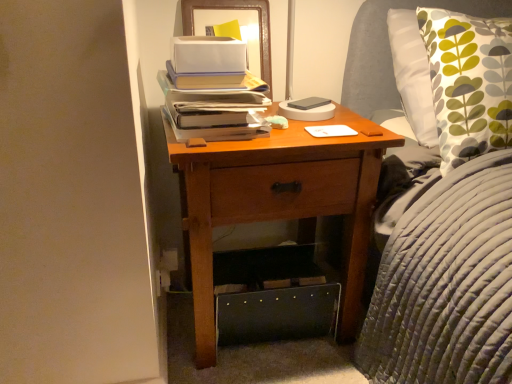
Question: From a real-world perspective, is matte paper stack of books at center on wooden nightstand at center?

Choices:
 (A) yes
 (B) no

Answer: (A)

Question: From a real-world perspective, does matte paper stack of books at center sit lower than wooden nightstand at center?

Choices:
 (A) no
 (B) yes

Answer: (A)

Question: Considering the relative sizes of matte paper stack of books at center and wooden nightstand at center in the image provided, is matte paper stack of books at center bigger than wooden nightstand at center?

Choices:
 (A) no
 (B) yes

Answer: (A)

Question: Is matte paper stack of books at center located outside wooden nightstand at center?

Choices:
 (A) yes
 (B) no

Answer: (A)

Question: Is matte paper stack of books at center in contact with wooden nightstand at center?

Choices:
 (A) yes
 (B) no

Answer: (B)

Question: From the image's perspective, is matte paper stack of books at center under wooden nightstand at center?

Choices:
 (A) yes
 (B) no

Answer: (B)

Question: Can you confirm if white matte notepad at center is positioned to the right of matte paper stack of books at center?

Choices:
 (A) no
 (B) yes

Answer: (B)

Question: From the image's perspective, would you say white matte notepad at center is shown under matte paper stack of books at center?

Choices:
 (A) no
 (B) yes

Answer: (B)

Question: From a real-world perspective, is white matte notepad at center physically above matte paper stack of books at center?

Choices:
 (A) yes
 (B) no

Answer: (B)

Question: Is white matte notepad at center further to camera compared to matte paper stack of books at center?

Choices:
 (A) no
 (B) yes

Answer: (B)

Question: Is matte paper stack of books at center a part of white matte notepad at center?

Choices:
 (A) yes
 (B) no

Answer: (B)

Question: Is white matte notepad at center closer to the viewer compared to matte paper stack of books at center?

Choices:
 (A) no
 (B) yes

Answer: (A)

Question: From the image's perspective, is wooden nightstand at center beneath wooden framed picture at upper center?

Choices:
 (A) no
 (B) yes

Answer: (B)